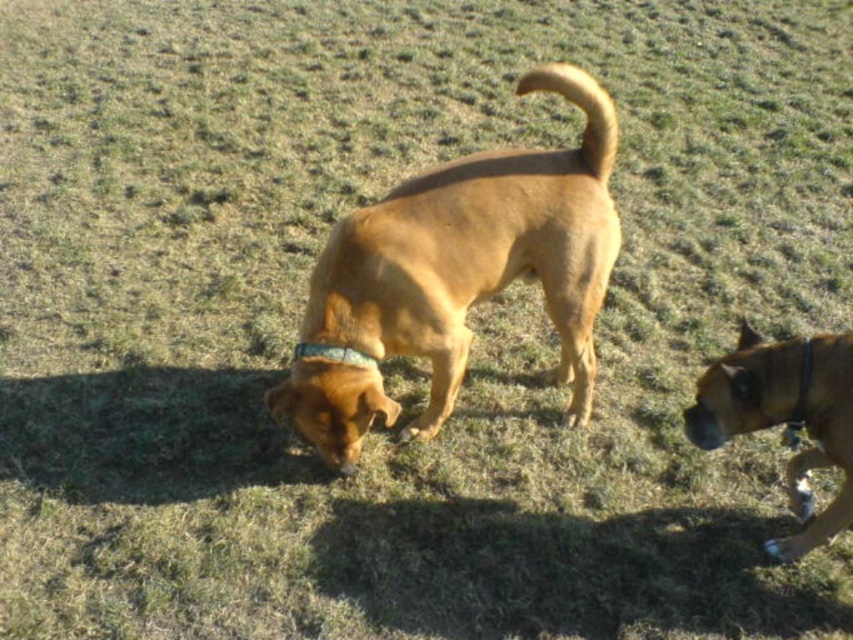
You are a photographer trying to capture both the brown matte dog at center and the brown leather dog at center in a single frame. Based on their positions, which dog should you adjust your camera angle to focus on first to ensure both are in the shot?

The brown matte dog at center is positioned on the left side of brown leather dog at center, so you should focus on the brown leather dog at center first to ensure both are included in the frame.

You are a dog trainer observing two dogs in a grassy field. You notice the brown matte dog at center and the brown leather dog at center. Which dog is taller?

The brown matte dog at center is taller than the brown leather dog at center.